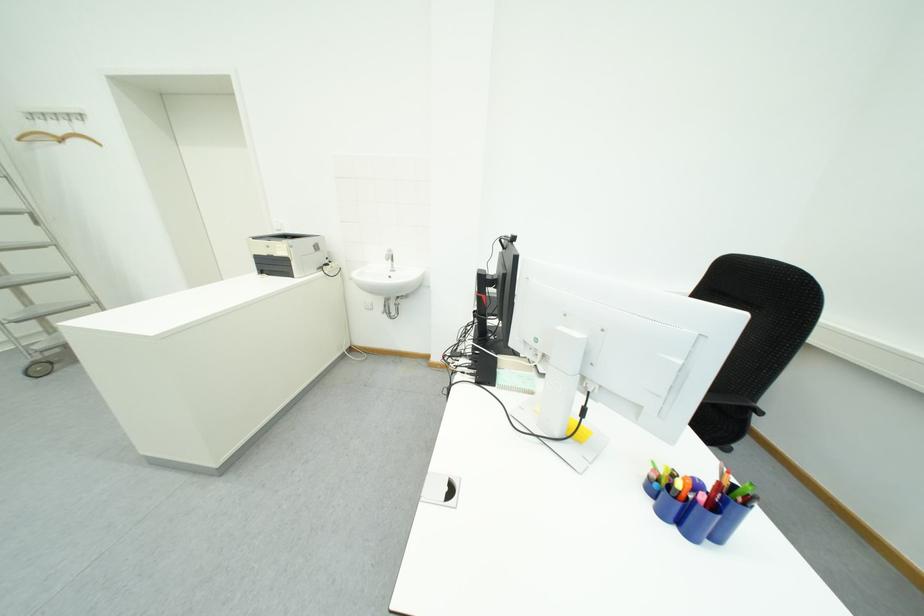
Where would you lift the faucet handle? Please return your answer as a coordinate pair (x, y).

(390, 262)